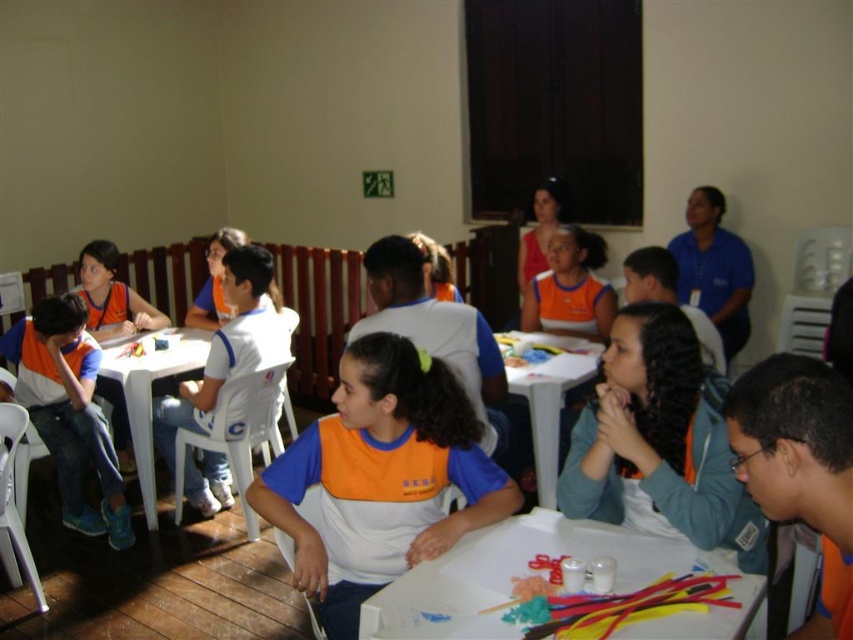
You are a teacher in the classroom and want to hand out materials to the children. You are standing at the front of the room. Which object, the matte orange shirt at left or the white plastic table at lower left, is closer to your current position?

The white plastic table at lower left is closer to your current position because the matte orange shirt at left is to the left of it, meaning the table is between you and the shirt.

You are standing at the entrance of the classroom and see the orange fabric shirt at center. If you walk straight towards the shirt, will you reach it before the wall behind it?

Answer: The orange fabric shirt at center is located at point (381, 476), which is closer to you than the wall behind it. Therefore, you will reach the shirt before the wall.